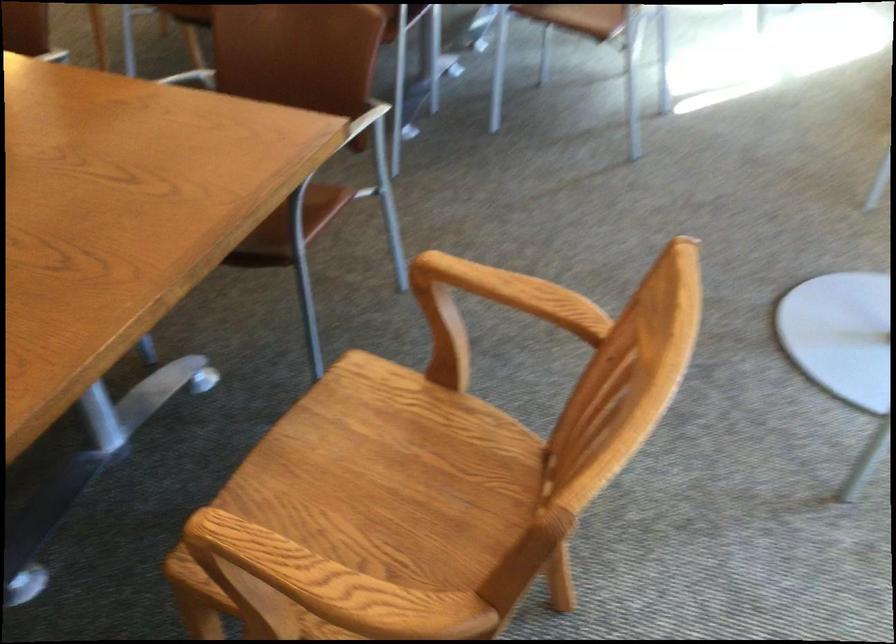
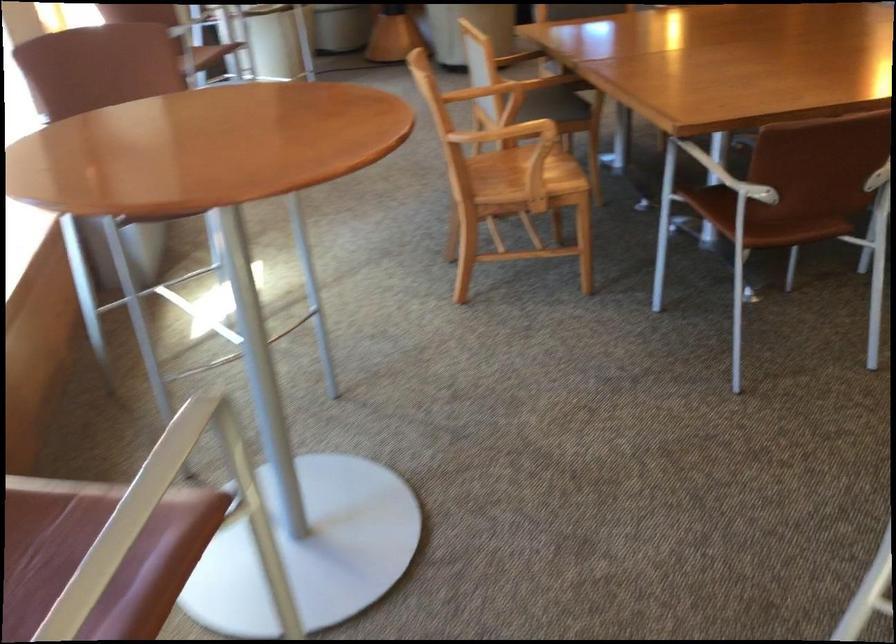
Question: I am providing you with two images of the same scene from different viewpoints. Please identify which objects are invisible in image2.

Choices:
 (A) white chair armrest
 (B) wooden chair sitting surface
 (C) black power cord
 (D) wooden chair armrest

Answer: (D)